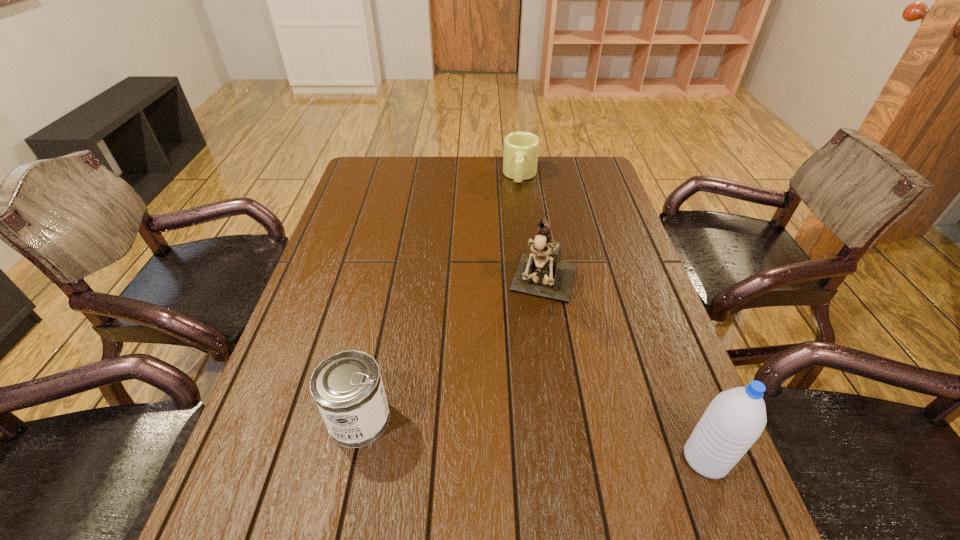
This screenshot has height=540, width=960. I want to click on free spot on the desktop that is between the leftmost object and the second tallest object and is positioned with the handle on the side of the farthest object, so click(x=488, y=434).

Locate an element on the screen. The height and width of the screenshot is (540, 960). free space on the desktop that is between the leftmost object and the water bottle and is positioned on the front-facing side of the third nearest object is located at coordinates (503, 435).